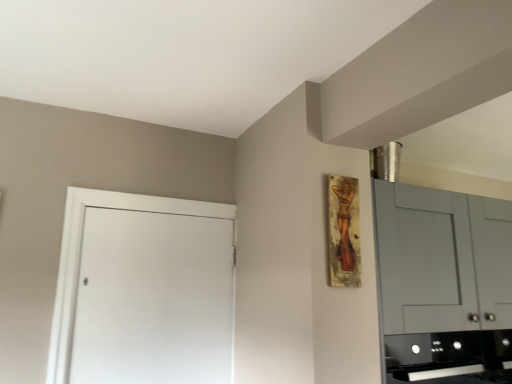
Question: Is wooden painting at upper right facing away from white matte door at left?

Choices:
 (A) yes
 (B) no

Answer: (B)

Question: Is wooden painting at upper right to the left of white matte door at left from the viewer's perspective?

Choices:
 (A) no
 (B) yes

Answer: (A)

Question: From the image's perspective, does wooden painting at upper right appear higher than white matte door at left?

Choices:
 (A) yes
 (B) no

Answer: (A)

Question: Does wooden painting at upper right have a lesser height compared to white matte door at left?

Choices:
 (A) no
 (B) yes

Answer: (B)

Question: From a real-world perspective, does wooden painting at upper right stand above white matte door at left?

Choices:
 (A) no
 (B) yes

Answer: (B)

Question: Is black glossy oven at lower right inside the boundaries of white matte door at left, or outside?

Choices:
 (A) outside
 (B) inside

Answer: (A)

Question: Is point (446, 347) positioned closer to the camera than point (206, 208)?

Choices:
 (A) closer
 (B) farther

Answer: (A)

Question: Visually, is black glossy oven at lower right positioned to the left or to the right of white matte door at left?

Choices:
 (A) right
 (B) left

Answer: (A)

Question: Considering the positions of black glossy oven at lower right and white matte door at left in the image, is black glossy oven at lower right wider or thinner than white matte door at left?

Choices:
 (A) wide
 (B) thin

Answer: (A)

Question: Considering the positions of white matte door at left and wooden painting at upper right in the image, is white matte door at left taller or shorter than wooden painting at upper right?

Choices:
 (A) short
 (B) tall

Answer: (B)

Question: Which is correct: white matte door at left is inside wooden painting at upper right, or outside of it?

Choices:
 (A) inside
 (B) outside

Answer: (B)

Question: Looking at the image, does white matte door at left seem bigger or smaller compared to wooden painting at upper right?

Choices:
 (A) big
 (B) small

Answer: (A)

Question: From a real-world perspective, relative to wooden painting at upper right, is white matte door at left vertically above or below?

Choices:
 (A) below
 (B) above

Answer: (A)

Question: Would you say wooden painting at upper right is to the left or to the right of black glossy oven at lower right in the picture?

Choices:
 (A) right
 (B) left

Answer: (B)

Question: From a real-world perspective, is wooden painting at upper right positioned above or below black glossy oven at lower right?

Choices:
 (A) below
 (B) above

Answer: (B)